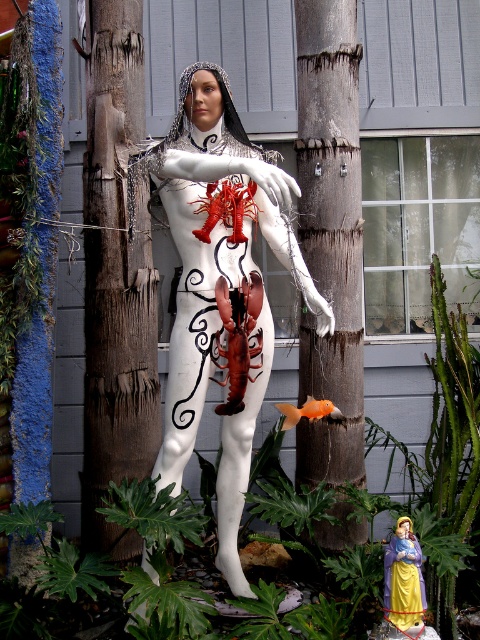
Which is in front, point (232, 566) or point (342, 205)?

Point (232, 566) is more forward.

Does white matte sculpture at center have a larger size compared to smooth brown wood at center?

Yes.

Which is behind, point (215, 324) or point (301, 481)?

Point (301, 481)

Where is `white matte sculpture at center`? The height and width of the screenshot is (640, 480). white matte sculpture at center is located at coordinates (214, 241).